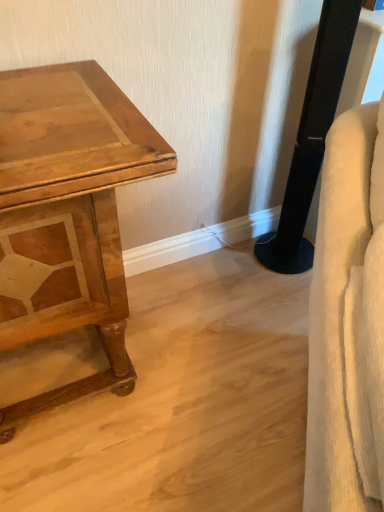
What do you see at coordinates (348, 322) in the screenshot? I see `white fabric swivel chair at right` at bounding box center [348, 322].

The height and width of the screenshot is (512, 384). Describe the element at coordinates (68, 213) in the screenshot. I see `wooden table at left` at that location.

Locate an element on the screen. This screenshot has height=512, width=384. white fabric swivel chair at right is located at coordinates (348, 322).

Does point (353, 310) appear closer or farther from the camera than point (64, 194)?

Point (353, 310).

Can wooden table at left be found inside white fabric swivel chair at right?

No, wooden table at left is not a part of white fabric swivel chair at right.

Considering the sizes of white fabric swivel chair at right and wooden table at left in the image, is white fabric swivel chair at right taller or shorter than wooden table at left?

Clearly, white fabric swivel chair at right is shorter compared to wooden table at left.

The image size is (384, 512). In the image, there is a wooden table at left. What are the coordinates of `swivel chair below it (from the image's perspective)` in the screenshot? It's located at (348, 322).

Considering the sizes of wooden table at left and white fabric swivel chair at right in the image, is wooden table at left wider or thinner than white fabric swivel chair at right?

wooden table at left is wider than white fabric swivel chair at right.

Considering the sizes of objects wooden table at left and white fabric swivel chair at right in the image provided, who is shorter, wooden table at left or white fabric swivel chair at right?

white fabric swivel chair at right.

Does point (94, 268) appear closer or farther from the camera than point (361, 163)?

Clearly, point (94, 268) is more distant from the camera than point (361, 163).

The width and height of the screenshot is (384, 512). What are the coordinates of `swivel chair above the wooden table at left (from a real-world perspective)` in the screenshot? It's located at (348, 322).

Is black plastic speaker at right in contact with wooden table at left?

No, black plastic speaker at right is not touching wooden table at left.

Is black plastic speaker at right facing away from wooden table at left?

No, wooden table at left is not at the back of black plastic speaker at right.

Does point (275, 259) come behind point (3, 291)?

Yes, it is behind point (3, 291).

This screenshot has height=512, width=384. Find the location of `pillar above the white fabric swivel chair at right (from the image's perspective)`. pillar above the white fabric swivel chair at right (from the image's perspective) is located at coordinates (311, 139).

Is black plastic speaker at right a part of white fabric swivel chair at right?

Definitely not — black plastic speaker at right is not inside white fabric swivel chair at right.

Is white fabric swivel chair at right shorter than black plastic speaker at right?

Yes, white fabric swivel chair at right is shorter than black plastic speaker at right.

From the image's perspective, between white fabric swivel chair at right and black plastic speaker at right, which one is located above?

black plastic speaker at right, from the image's perspective.

Does point (323, 40) appear closer or farther from the camera than point (347, 275)?

Point (323, 40) is positioned farther from the camera compared to point (347, 275).

Are black plastic speaker at right and white fabric swivel chair at right far apart?

No, black plastic speaker at right is not far away from white fabric swivel chair at right.

Is black plastic speaker at right outside of white fabric swivel chair at right?

Yes, black plastic speaker at right is outside of white fabric swivel chair at right.

From the image's perspective, which one is positioned higher, black plastic speaker at right or white fabric swivel chair at right?

black plastic speaker at right is shown above in the image.

Considering the relative sizes of wooden table at left and black plastic speaker at right in the image provided, is wooden table at left smaller than black plastic speaker at right?

No.

Is wooden table at left to the left of black plastic speaker at right from the viewer's perspective?

Correct, you'll find wooden table at left to the left of black plastic speaker at right.

Which is more distant, (66,292) or (299,208)?

The point (299,208) is more distant.

Consider the image. Is wooden table at left positioned far away from black plastic speaker at right?

No, wooden table at left is not far from black plastic speaker at right.

I want to click on swivel chair on the right side of wooden table at left, so click(x=348, y=322).

Where is `swivel chair below the wooden table at left (from the image's perspective)`? This screenshot has width=384, height=512. swivel chair below the wooden table at left (from the image's perspective) is located at coordinates (348, 322).

Estimate the real-world distances between objects in this image. Which object is closer to black plastic speaker at right, wooden table at left or white fabric swivel chair at right?

white fabric swivel chair at right is positioned closer to the anchor black plastic speaker at right.

Which object lies nearer to the anchor point black plastic speaker at right, white fabric swivel chair at right or wooden table at left?

Based on the image, white fabric swivel chair at right appears to be nearer to black plastic speaker at right.

When comparing their distances from wooden table at left, does black plastic speaker at right or white fabric swivel chair at right seem further?

Among the two, black plastic speaker at right is located further to wooden table at left.

Considering their positions, is wooden table at left positioned further to white fabric swivel chair at right than black plastic speaker at right?

black plastic speaker at right is further to white fabric swivel chair at right.

Based on the photo, looking at the image, which one is located further to white fabric swivel chair at right, black plastic speaker at right or wooden table at left?

black plastic speaker at right is positioned further to the anchor white fabric swivel chair at right.

From the image, which object appears to be nearer to wooden table at left, white fabric swivel chair at right or black plastic speaker at right?

The object closer to wooden table at left is white fabric swivel chair at right.

Where is `swivel chair situated between wooden table at left and black plastic speaker at right from left to right`? The width and height of the screenshot is (384, 512). swivel chair situated between wooden table at left and black plastic speaker at right from left to right is located at coordinates (348, 322).